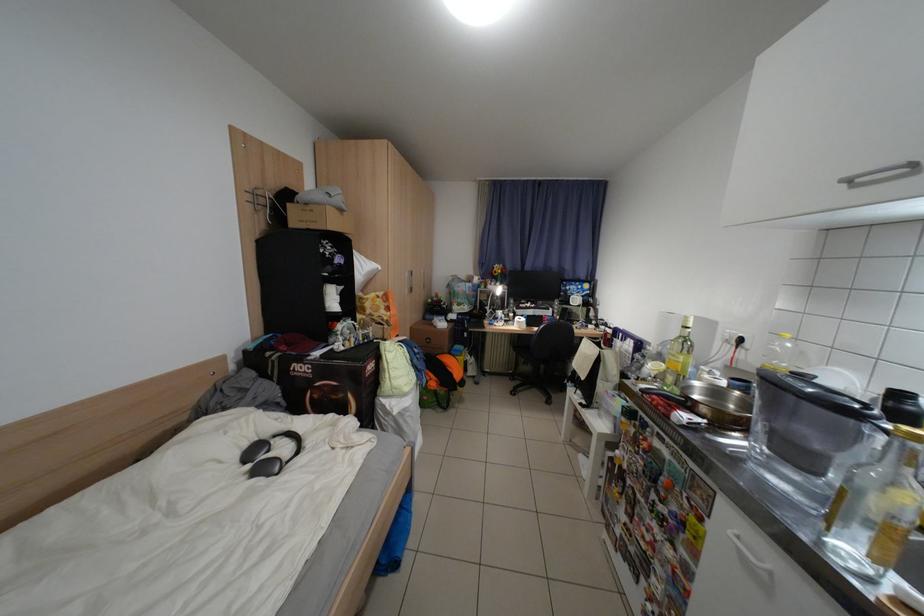
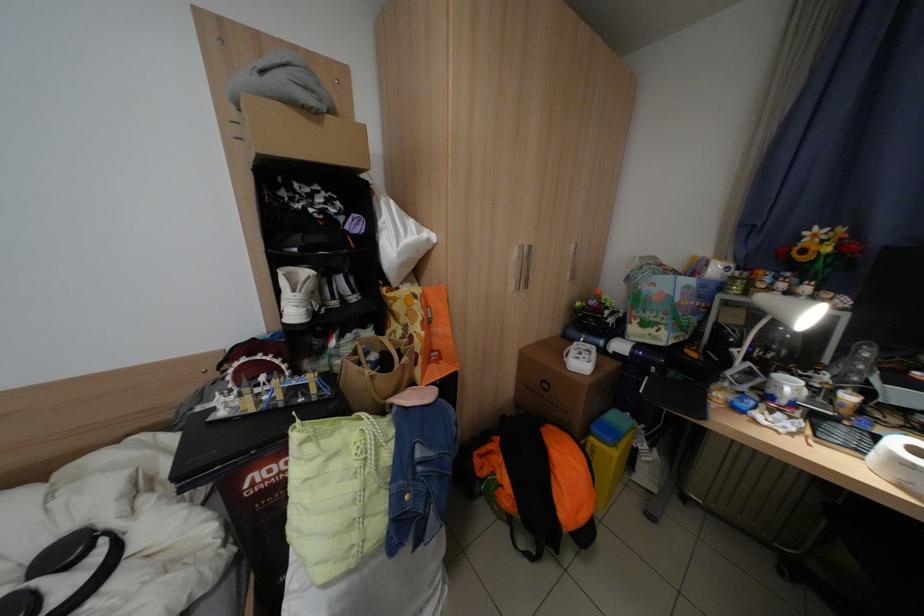
Find the pixel in the second image that matches point 501,312 in the first image.

(752, 366)